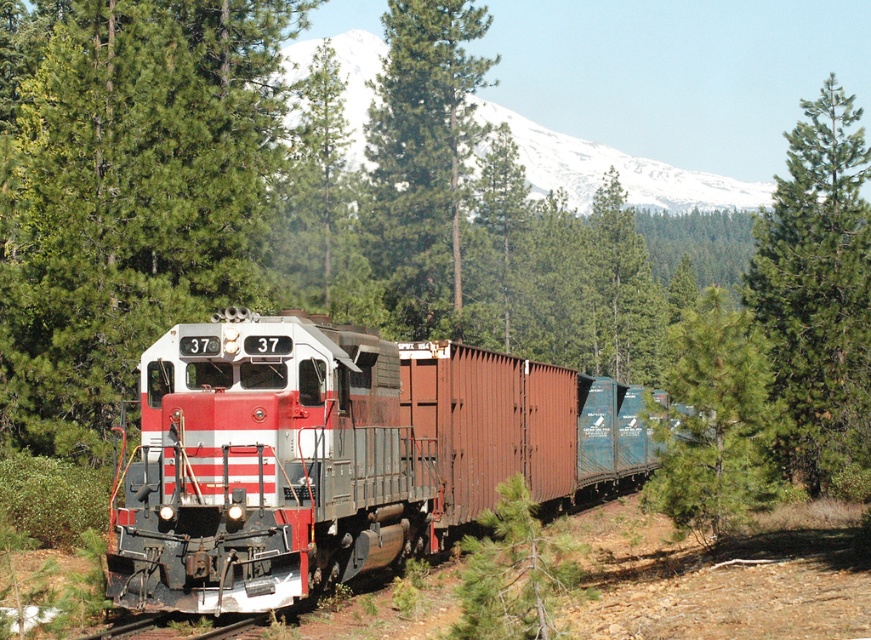
Question: Estimate the real-world distances between objects in this image. Which object is farther from the green matte tree at center?

Choices:
 (A) metal at bottom
 (B) matte red train at center

Answer: (A)

Question: Among these points, which one is nearest to the camera?

Choices:
 (A) (134, 624)
 (B) (231, 221)
 (C) (350, 58)
 (D) (311, 589)

Answer: (A)

Question: Considering the relative positions of green textured tree at center and green matte tree at center in the image provided, where is green textured tree at center located with respect to green matte tree at center?

Choices:
 (A) above
 (B) below

Answer: (B)

Question: Estimate the real-world distances between objects in this image. Which object is farther from the metal at bottom?

Choices:
 (A) snowy mountain at upper center
 (B) green matte tree at center
 (C) matte red train at center

Answer: (A)

Question: Can you confirm if green textured tree at center is smaller than snowy mountain at upper center?

Choices:
 (A) yes
 (B) no

Answer: (A)

Question: Observing the image, what is the correct spatial positioning of matte red train at center in reference to metal at bottom?

Choices:
 (A) right
 (B) left

Answer: (A)